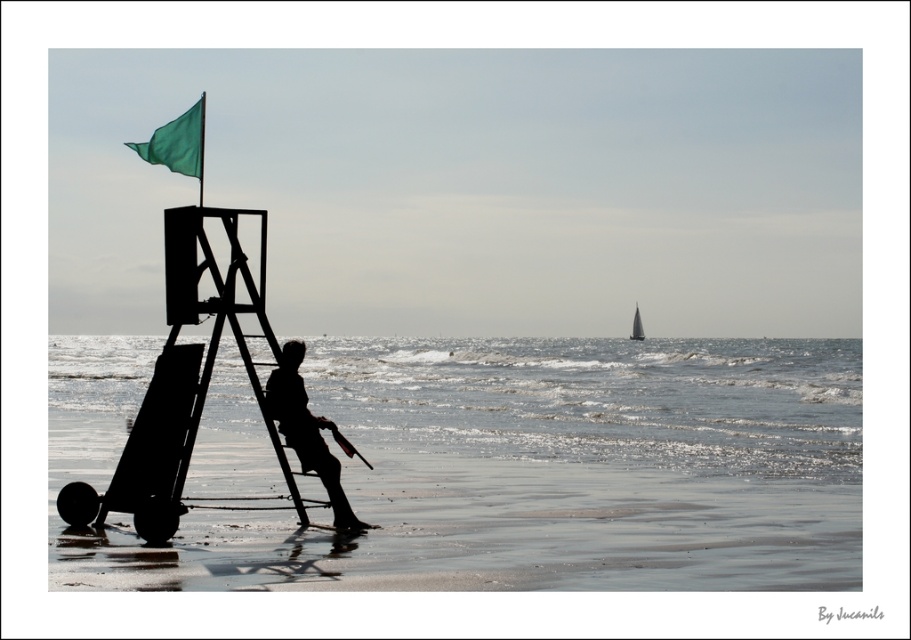
Which is behind, point (333, 460) or point (139, 154)?

Point (333, 460)

Does silhouette wood person at center have a lesser width compared to green fabric flag at upper left?

Yes, silhouette wood person at center is thinner than green fabric flag at upper left.

This screenshot has width=911, height=640. Find the location of `silhouette wood person at center`. silhouette wood person at center is located at coordinates (306, 432).

Between point (578, 588) and point (718, 356), which one is positioned in front?

Point (578, 588) is more forward.

Does smooth sand at lower center have a smaller size compared to clear water at center?

Yes, smooth sand at lower center is smaller than clear water at center.

Does point (540, 566) lie in front of point (237, 369)?

Yes.

Locate an element on the screen. smooth sand at lower center is located at coordinates click(x=527, y=524).

Can you confirm if clear water at center is bigger than green fabric flag at upper left?

No.

Does point (67, 372) lie in front of point (200, 147)?

No, (67, 372) is further to viewer.

Locate an element on the screen. This screenshot has width=911, height=640. clear water at center is located at coordinates (602, 401).